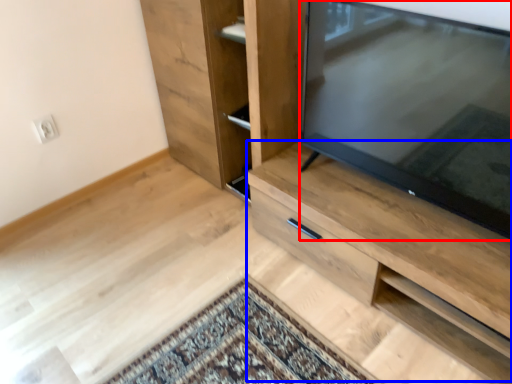
Question: Which point is closer to the camera, television (highlighted by a red box) or cabinetry (highlighted by a blue box)?

Choices:
 (A) television
 (B) cabinetry

Answer: (A)